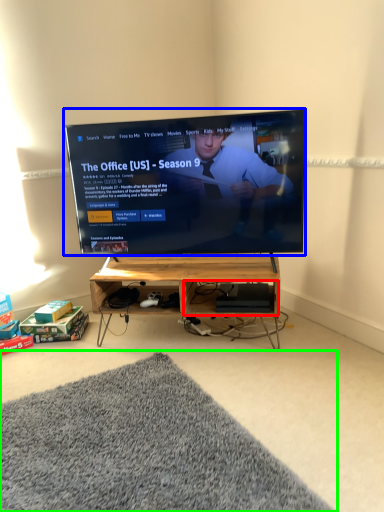
Question: Which object is positioned farthest from shelf (highlighted by a red box)? Select from television (highlighted by a blue box) and mat (highlighted by a green box).

Choices:
 (A) television
 (B) mat

Answer: (B)